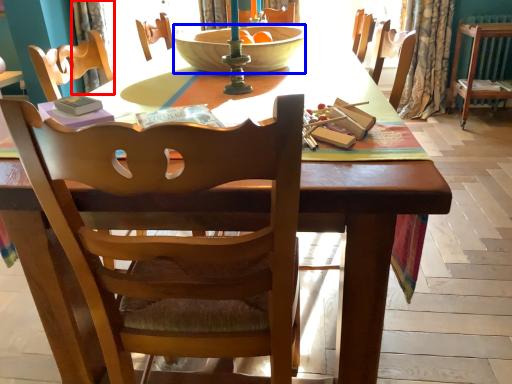
Question: Which point is closer to the camera, curtain (highlighted by a red box) or bowl (highlighted by a blue box)?

Choices:
 (A) curtain
 (B) bowl

Answer: (B)